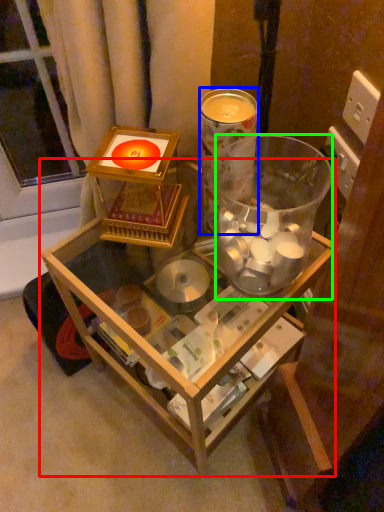
Question: Based on their relative distances, which object is farther from table (highlighted by a red box)? Choose from beverage (highlighted by a blue box) and beverage (highlighted by a green box).

Choices:
 (A) beverage
 (B) beverage

Answer: (A)